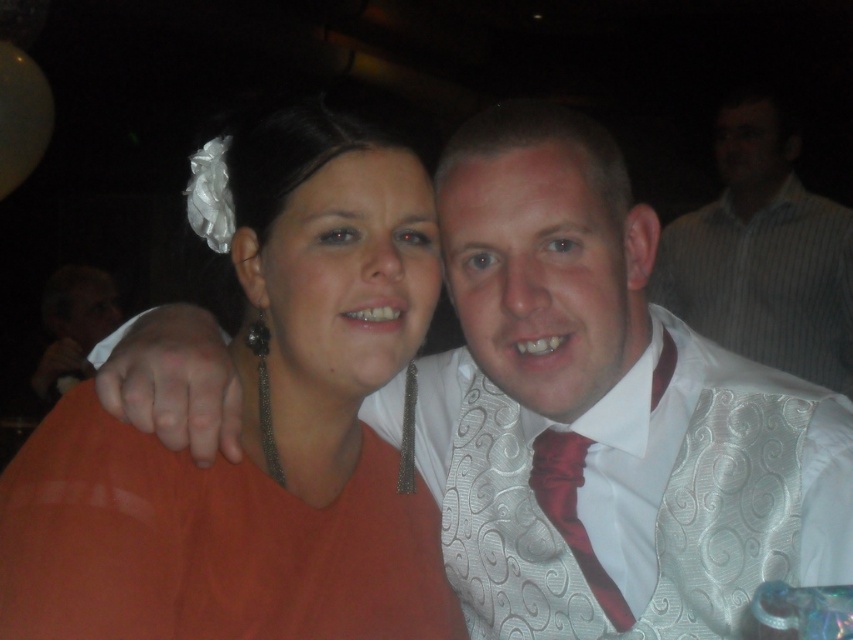
What are the coordinates of `orange fabric dress at center` in the screenshot? It's located at (207, 545).

Who is positioned more to the left, orange fabric dress at center or white textured shirt at upper right?

From the viewer's perspective, orange fabric dress at center appears more on the left side.

Find the location of a particular element. The width and height of the screenshot is (853, 640). orange fabric dress at center is located at coordinates (207, 545).

Describe the element at coordinates (259, 433) in the screenshot. I see `orange fabric at center` at that location.

Between point (375, 484) and point (746, 512), which one is positioned in front?

Positioned in front is point (746, 512).

Does point (338, 632) come in front of point (495, 486)?

Yes, point (338, 632) is closer to viewer.

At what (x,y) coordinates should I click in order to perform the action: click on orange fabric at center. Please return your answer as a coordinate pair (x, y). Image resolution: width=853 pixels, height=640 pixels. Looking at the image, I should click on (259, 433).

Identify the location of white textured dress shirt at center. (640, 493).

Which of these two, white textured dress shirt at center or shiny red tie at center, stands taller?

With more height is white textured dress shirt at center.

Is point (817, 576) positioned before point (531, 477)?

Yes, it is in front of point (531, 477).

Identify the location of white textured dress shirt at center. (640, 493).